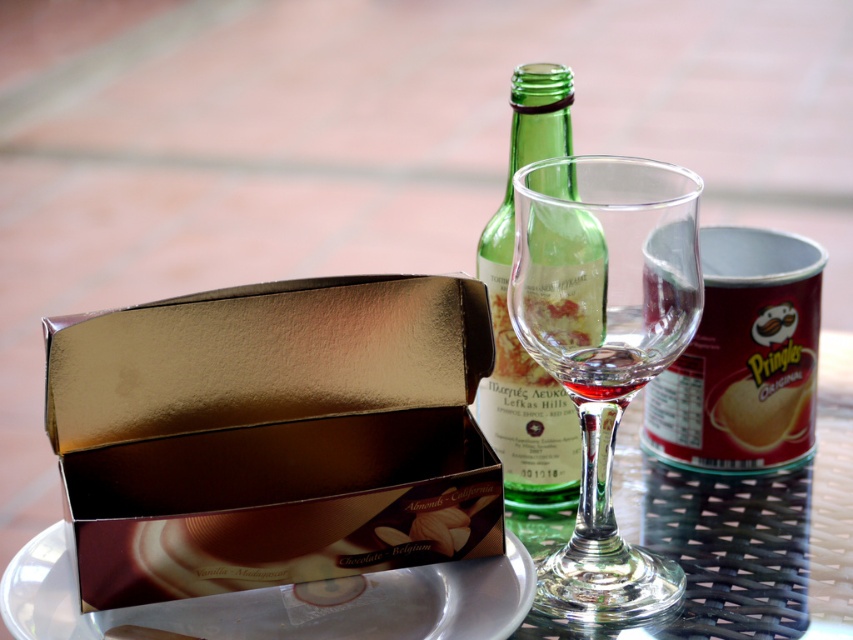
Question: From the image, what is the correct spatial relationship of white glossy plate at center in relation to matte gold box at center?

Choices:
 (A) left
 (B) right

Answer: (A)

Question: Can you confirm if white glossy plate at center is bigger than matte gold box at center?

Choices:
 (A) no
 (B) yes

Answer: (B)

Question: Which object appears farthest from the camera in this image?

Choices:
 (A) white glossy plate at center
 (B) matte gold box at center
 (C) transparent glass wine glass at center
 (D) green glass bottle at center

Answer: (B)

Question: Is transparent glass wine glass at center bigger than white glossy plate at center?

Choices:
 (A) no
 (B) yes

Answer: (B)

Question: Which of the following is the closest to the observer?

Choices:
 (A) (759, 417)
 (B) (642, 368)

Answer: (B)

Question: Which point is farther from the camera taking this photo?

Choices:
 (A) (753, 444)
 (B) (631, 220)
 (C) (59, 627)
 (D) (535, 129)

Answer: (A)